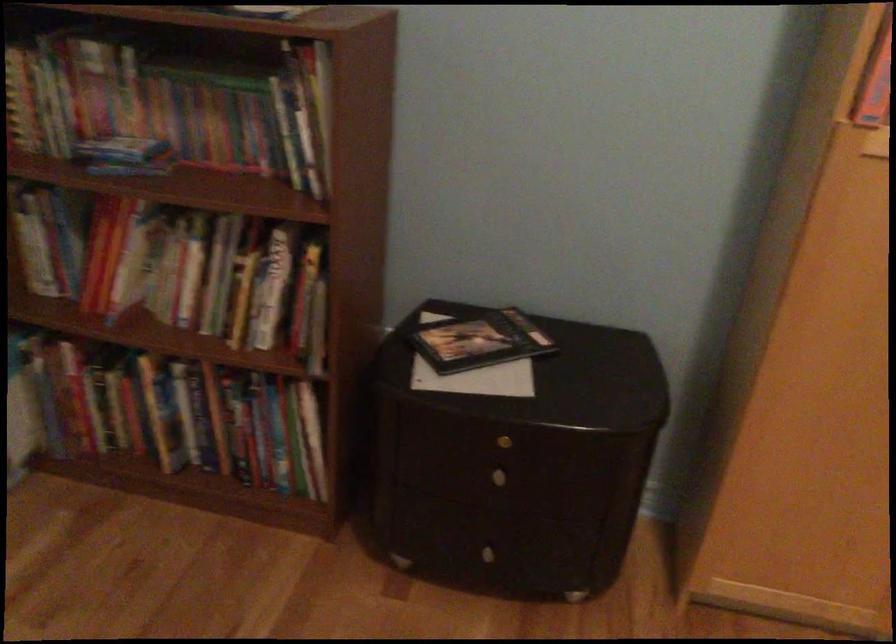
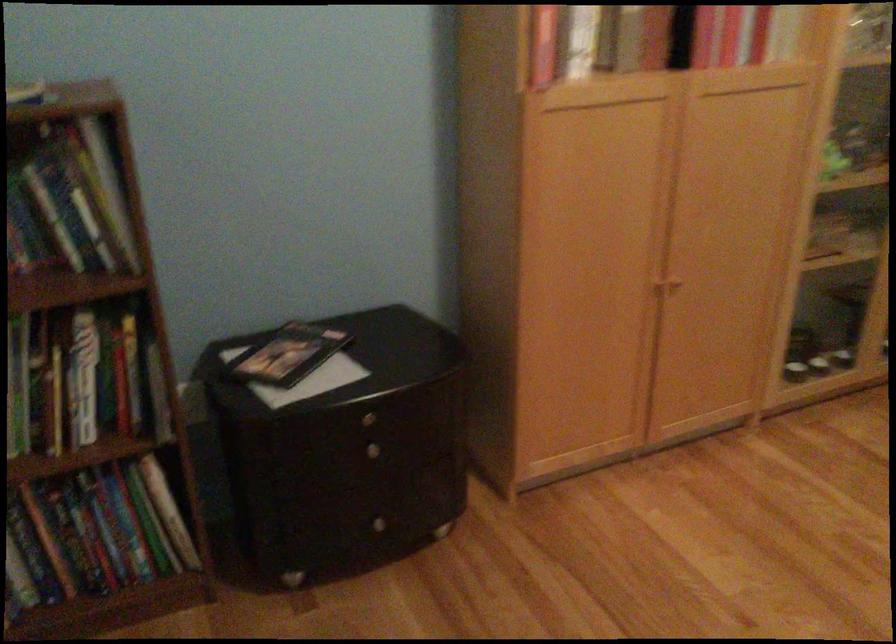
Find the pixel in the second image that matches pixel 487 552 in the first image.

(380, 524)